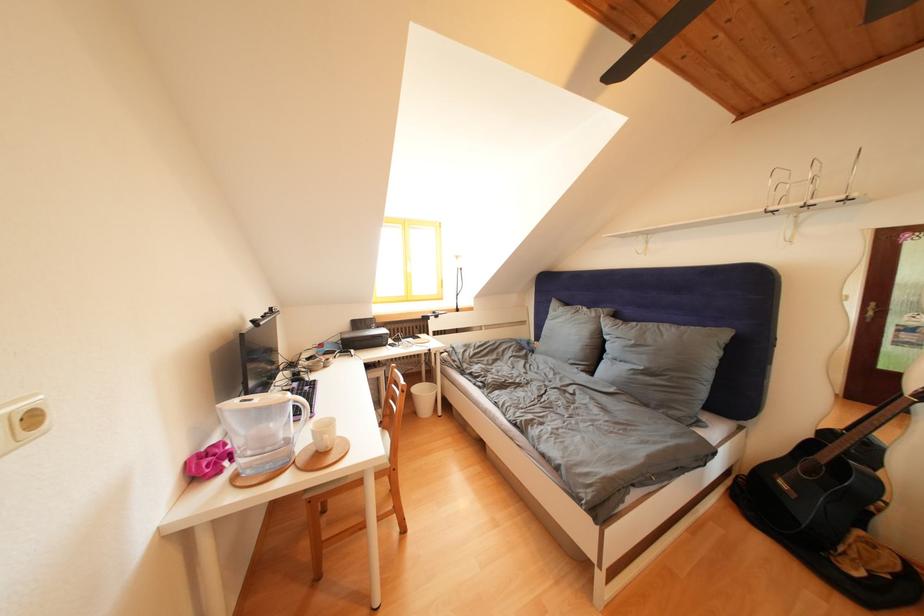
The location [821,482] corresponds to which object?

This point indicates the black guitar case.